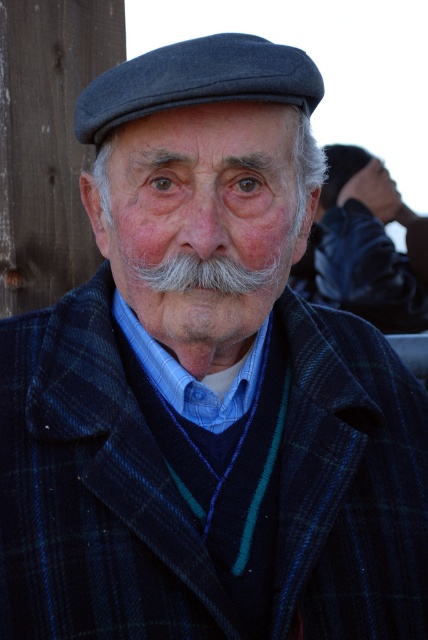
Question: Can you confirm if white mustache at center is positioned to the right of gray woolen cap at upper center?

Choices:
 (A) yes
 (B) no

Answer: (B)

Question: Is gray woolen cap at upper center behind dark blue felt cap at upper center?

Choices:
 (A) yes
 (B) no

Answer: (A)

Question: Can you confirm if gray woolen cap at upper center is positioned above dark blue felt cap at upper center?

Choices:
 (A) no
 (B) yes

Answer: (B)

Question: Which point is closer to the camera?

Choices:
 (A) (217, 193)
 (B) (119, 116)

Answer: (B)

Question: Which of the following is the farthest from the observer?

Choices:
 (A) gray woolen cap at upper center
 (B) dark blue felt cap at upper center
 (C) white mustache at center

Answer: (A)

Question: Which object appears closest to the camera in this image?

Choices:
 (A) white mustache at center
 (B) gray woolen cap at upper center

Answer: (A)